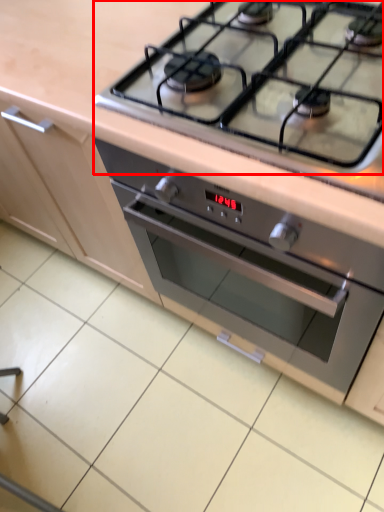
Question: Considering the relative positions of gas stove (annotated by the red box) and oven in the image provided, where is gas stove (annotated by the red box) located with respect to the staircase?

Choices:
 (A) left
 (B) right

Answer: (A)